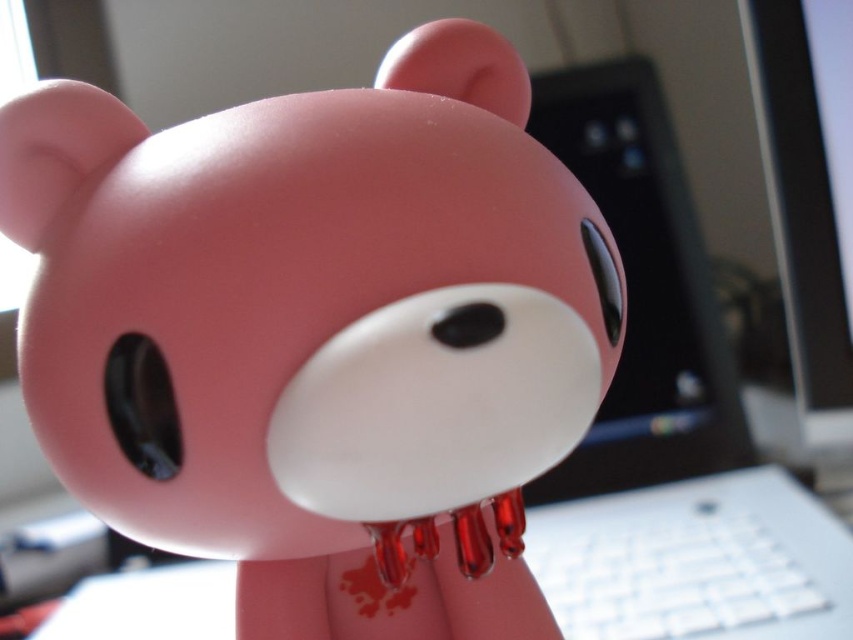
You are organizing items on a desk and notice the matte pink bear at center and the sleek black laptop at center. Which item is positioned closer to you?

The matte pink bear at center is closer to the viewer than the sleek black laptop at center.

You are organizing a desk and need to place the matte pink bear at center and the sleek black laptop at center. According to the image, which object is positioned to the right side of the desk?

The sleek black laptop at center is positioned to the right side of the desk because the matte pink bear at center is to the left of it.